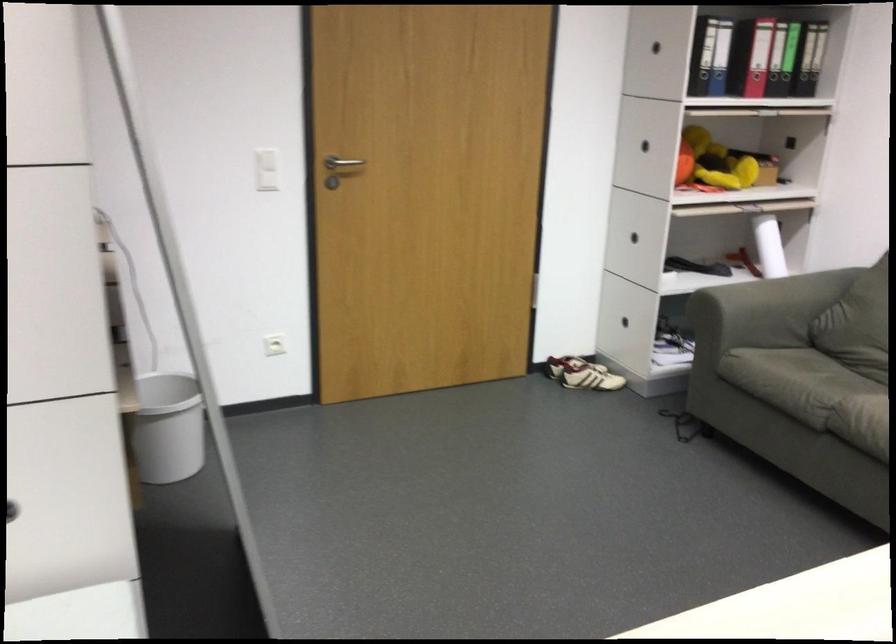
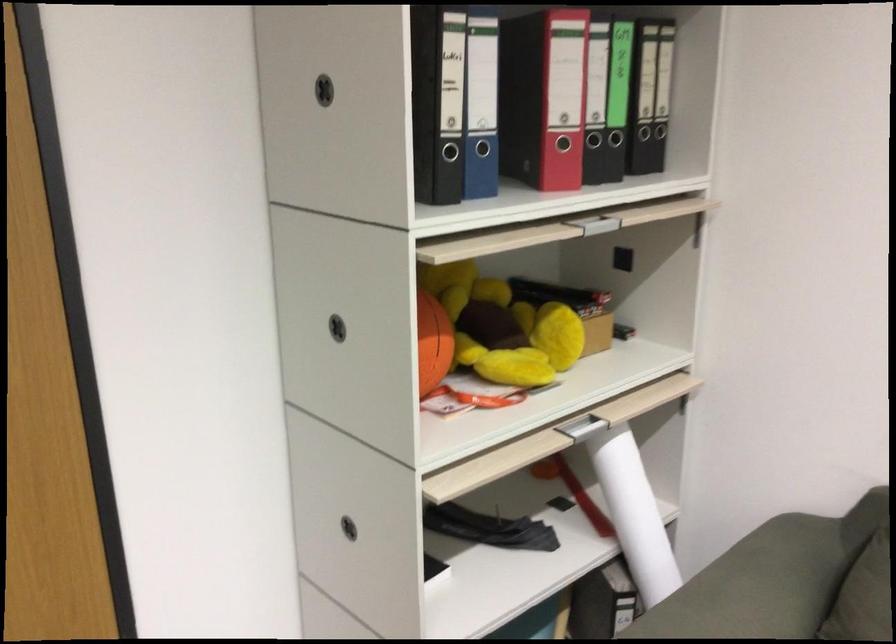
In the second image, find the point that corresponds to point (625, 232) in the first image.

(348, 527)